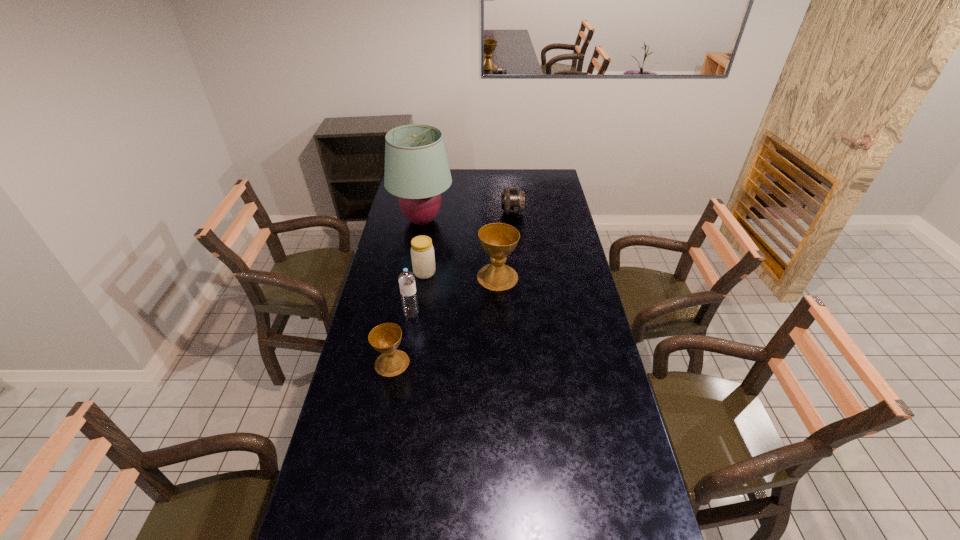
This screenshot has width=960, height=540. What are the coordinates of `vacant space at the far edge of the desktop` in the screenshot? It's located at (500, 186).

Locate an element on the screen. This screenshot has height=540, width=960. blank space at the left edge of the desktop is located at coordinates (398, 251).

Find the location of `free space at the right edge`. free space at the right edge is located at coordinates (617, 401).

The image size is (960, 540). I want to click on vacant space that is in between the nearest object and the telephoto lens, so click(452, 288).

In order to click on free spot between the tallest object and the telephoto lens in this screenshot , I will do `click(468, 217)`.

What are the coordinates of `free spot between the farther chalice and the jar` in the screenshot? It's located at (461, 275).

Find the location of a particular element. The width and height of the screenshot is (960, 540). free spot between the shorter chalice and the telephoto lens is located at coordinates (452, 288).

Where is `vacant space in between the taller chalice and the lampshade`? vacant space in between the taller chalice and the lampshade is located at coordinates (460, 248).

I want to click on vacant space that's between the jar and the second nearest object, so click(418, 293).

What are the coordinates of `unoccupied area between the tallest object and the farther chalice` in the screenshot? It's located at (460, 248).